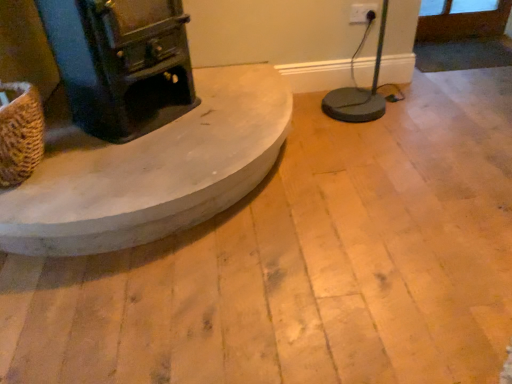
Question: Is smooth concrete hearth at center facing towards brown woven basket at left?

Choices:
 (A) no
 (B) yes

Answer: (A)

Question: Is smooth concrete hearth at center looking in the opposite direction of brown woven basket at left?

Choices:
 (A) yes
 (B) no

Answer: (B)

Question: Does smooth concrete hearth at center appear on the left side of brown woven basket at left?

Choices:
 (A) yes
 (B) no

Answer: (B)

Question: Is brown woven basket at left a part of smooth concrete hearth at center?

Choices:
 (A) yes
 (B) no

Answer: (B)

Question: Is smooth concrete hearth at center positioned before brown woven basket at left?

Choices:
 (A) no
 (B) yes

Answer: (A)

Question: Is brown woven basket at left bigger or smaller than smooth concrete hearth at center?

Choices:
 (A) small
 (B) big

Answer: (A)

Question: Is brown woven basket at left inside the boundaries of smooth concrete hearth at center, or outside?

Choices:
 (A) inside
 (B) outside

Answer: (B)

Question: Is brown woven basket at left wider or thinner than smooth concrete hearth at center?

Choices:
 (A) wide
 (B) thin

Answer: (B)

Question: From their relative heights in the image, would you say brown woven basket at left is taller or shorter than smooth concrete hearth at center?

Choices:
 (A) short
 (B) tall

Answer: (B)

Question: Considering the positions of smooth concrete hearth at center and white plastic electric outlet at upper right in the image, is smooth concrete hearth at center bigger or smaller than white plastic electric outlet at upper right?

Choices:
 (A) small
 (B) big

Answer: (B)

Question: Is smooth concrete hearth at center in front of or behind white plastic electric outlet at upper right in the image?

Choices:
 (A) behind
 (B) front

Answer: (B)

Question: From the image's perspective, is smooth concrete hearth at center positioned above or below white plastic electric outlet at upper right?

Choices:
 (A) below
 (B) above

Answer: (A)

Question: Does point (152, 152) appear closer or farther from the camera than point (373, 16)?

Choices:
 (A) closer
 (B) farther

Answer: (A)

Question: Is point (10, 162) closer or farther from the camera than point (351, 18)?

Choices:
 (A) farther
 (B) closer

Answer: (B)

Question: Is brown woven basket at left taller or shorter than white plastic electric outlet at upper right?

Choices:
 (A) tall
 (B) short

Answer: (A)